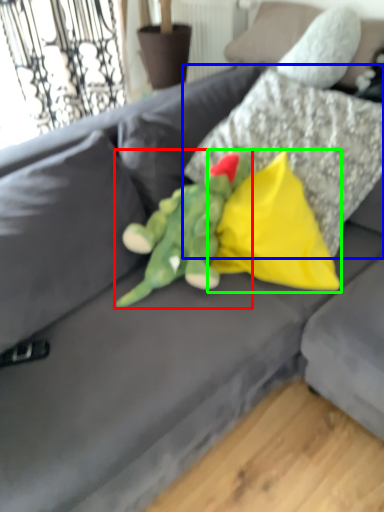
Question: Which object is the farthest from toy (highlighted by a red box)? Choose among these: pillow (highlighted by a blue box) or pillow (highlighted by a green box).

Choices:
 (A) pillow
 (B) pillow

Answer: (A)